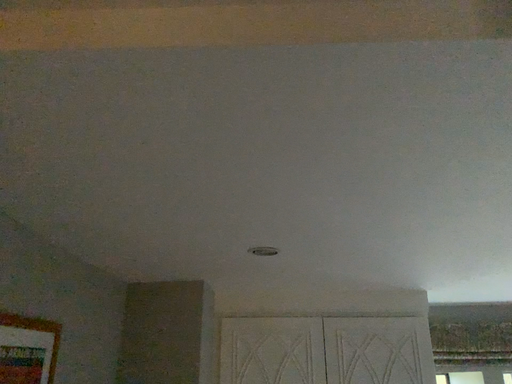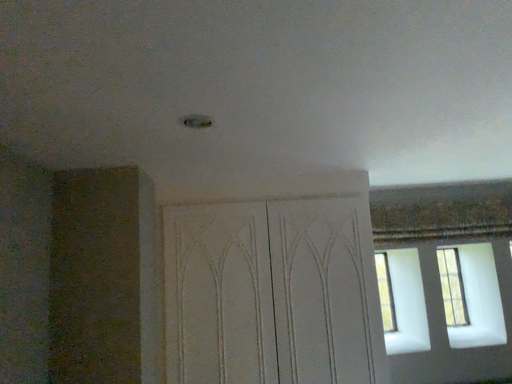
Question: How did the camera likely rotate when shooting the video?

Choices:
 (A) rotated upward
 (B) rotated downward

Answer: (B)